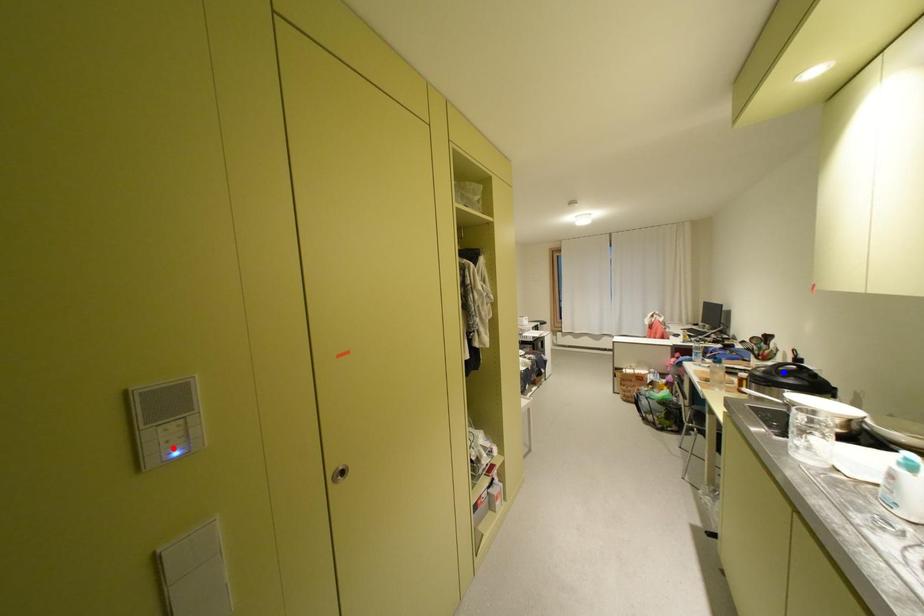
Question: Which of the two points in the image is closer to the camera?

Choices:
 (A) Blue point is closer.
 (B) Red point is closer.

Answer: (B)